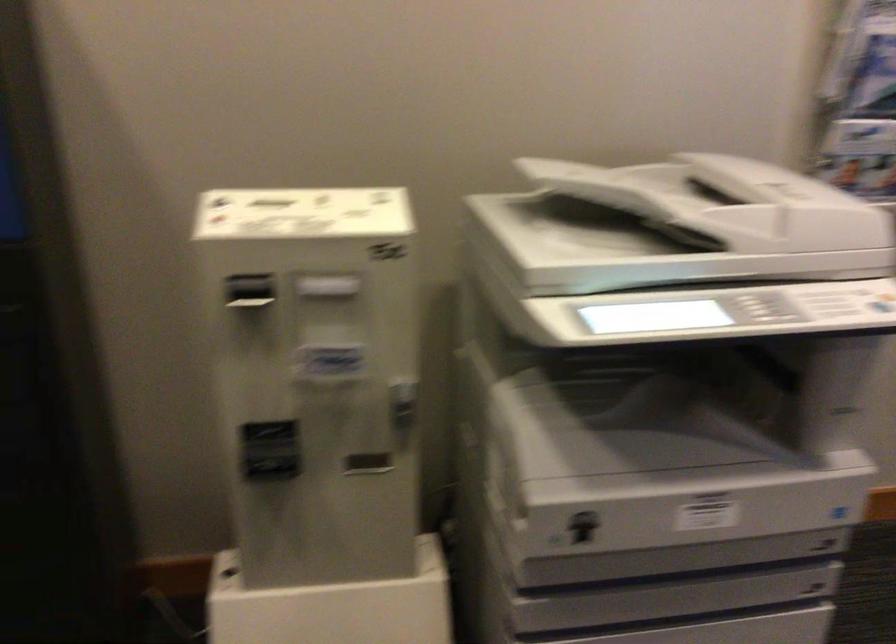
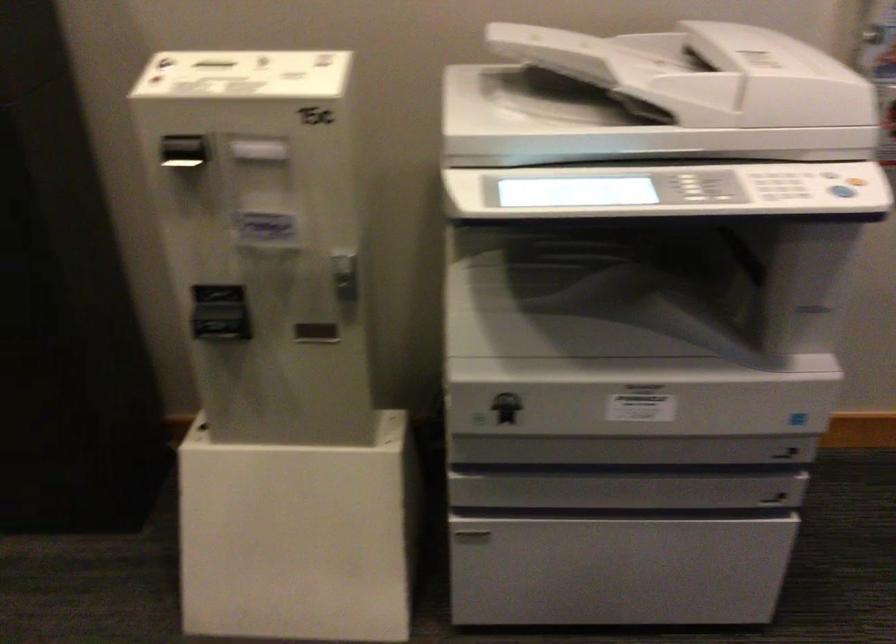
The point at (750, 205) is marked in the first image. Where is the corresponding point in the second image?

(702, 73)